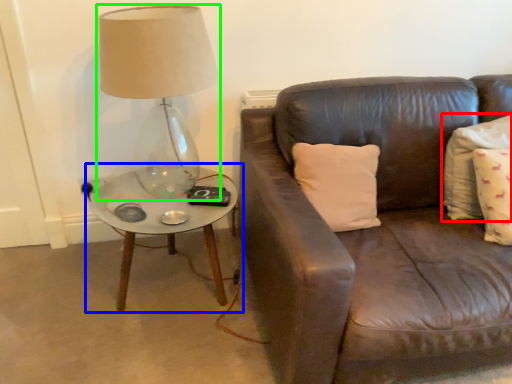
Question: Considering the real-world distances, which object is closest to pillow (highlighted by a red box)? coffee table (highlighted by a blue box) or lamp (highlighted by a green box).

Choices:
 (A) coffee table
 (B) lamp

Answer: (A)